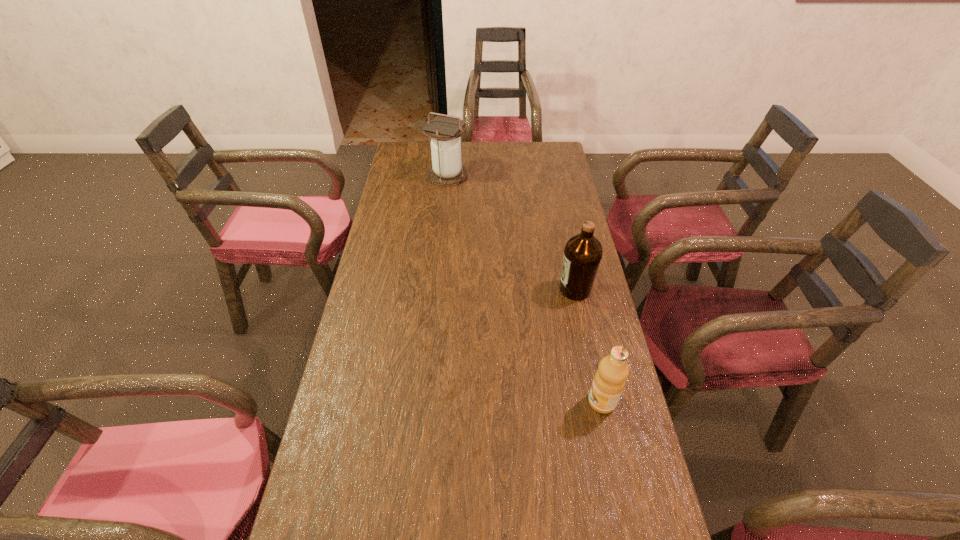
At what (x,y) coordinates should I click in order to perform the action: click on vacant point located between the farthest object and the taller olive oil. Please return your answer as a coordinate pair (x, y). This screenshot has width=960, height=540. Looking at the image, I should click on (512, 232).

Identify the location of vacant area between the farthest object and the taller olive oil. The image size is (960, 540). (512, 232).

What are the coordinates of `empty space between the second nearest object and the lantern` in the screenshot? It's located at (512, 232).

You are a GUI agent. You are given a task and a screenshot of the screen. Output one action in this format:
    pyautogui.click(x=<x>, y=<y>)
    Task: Click on the free space between the leftmost object and the second nearest object
    This screenshot has height=540, width=960.
    Given the screenshot: What is the action you would take?
    pyautogui.click(x=512, y=232)

Locate an element on the screen. The width and height of the screenshot is (960, 540). free space between the leftmost object and the second nearest object is located at coordinates (x=512, y=232).

Locate an element on the screen. This screenshot has height=540, width=960. vacant area that lies between the nearer olive oil and the second nearest object is located at coordinates [x=588, y=346].

Find the location of a particular element. The width and height of the screenshot is (960, 540). free spot between the shortest object and the lantern is located at coordinates (525, 288).

You are a GUI agent. You are given a task and a screenshot of the screen. Output one action in this format:
    pyautogui.click(x=<x>, y=<y>)
    Task: Click on the object that is the closest to the leftmost object
    
    Given the screenshot: What is the action you would take?
    pyautogui.click(x=582, y=255)

Find the location of a particular element. The image size is (960, 540). object that is the second closest to the shortest object is located at coordinates (447, 169).